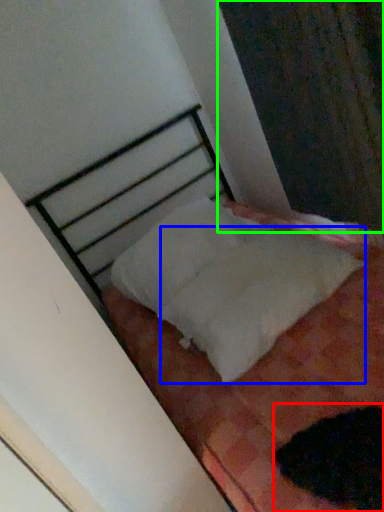
Question: Which object is the farthest from animal (highlighted by a red box)? Choose among these: sheet (highlighted by a blue box) or curtain (highlighted by a green box).

Choices:
 (A) sheet
 (B) curtain

Answer: (B)